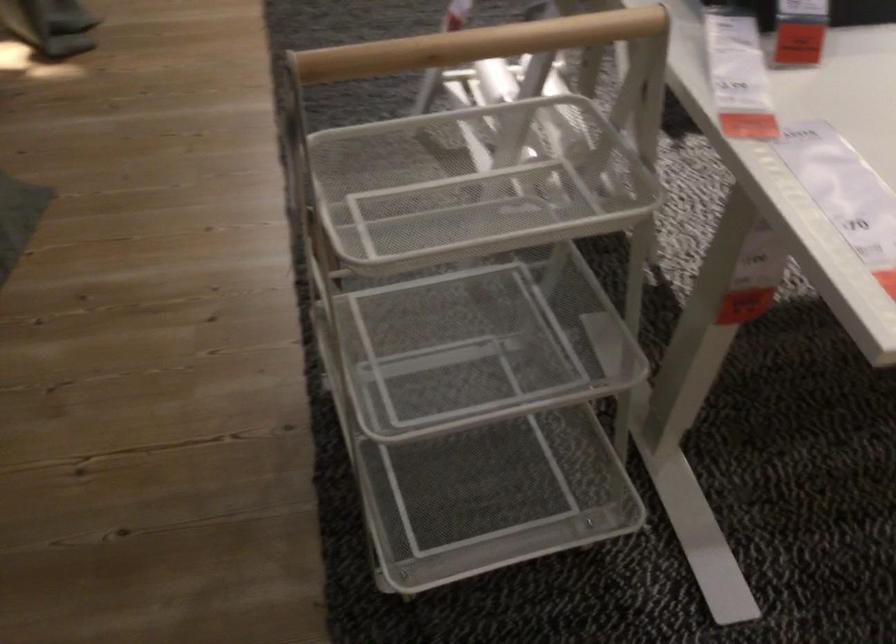
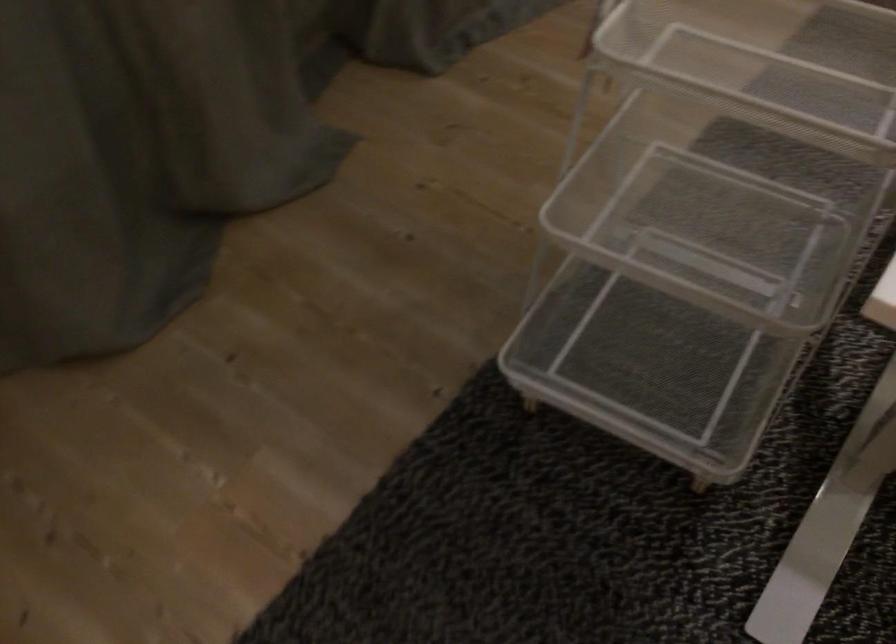
Where in the second image is the point corresponding to point (442, 339) from the first image?

(698, 209)